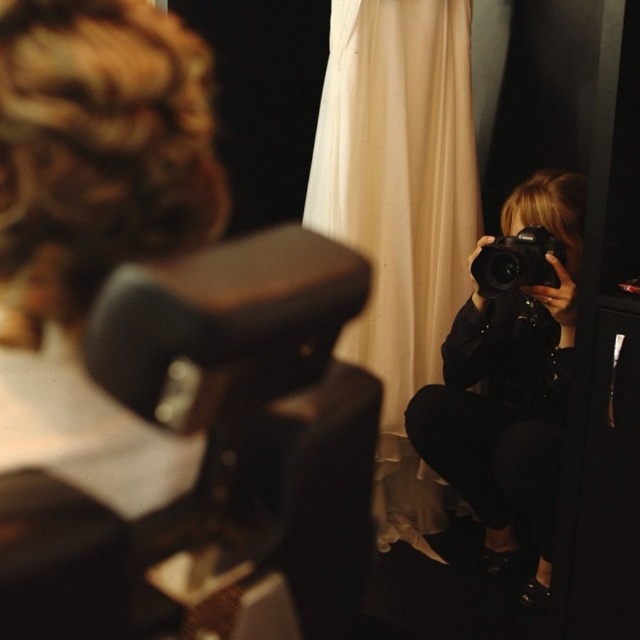
You are a photographer trying to decide where to place a new tripod in this scene. You need to choose between placing it behind the white fabric curtain at center or behind the black matte camera at center. Which location will allow the tripod to have more space around it?

The white fabric curtain at center is bigger than the black matte camera at center, so placing the tripod behind the white fabric curtain at center will provide more space around it.

You are a photographer holding a black matte camera at center. You want to take a photo of the blurred reflection of a person with curly hair in the foreground. However, there is another camera in the scene. How far apart are the two cameras?

The black matte camera at center and the camera are 1.56 meters apart from each other.